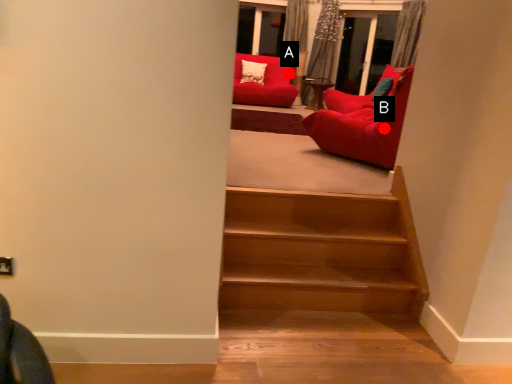
Question: Two points are circled on the image, labeled by A and B beside each circle. Which point appears closest to the camera in this image?

Choices:
 (A) A is closer
 (B) B is closer

Answer: (B)